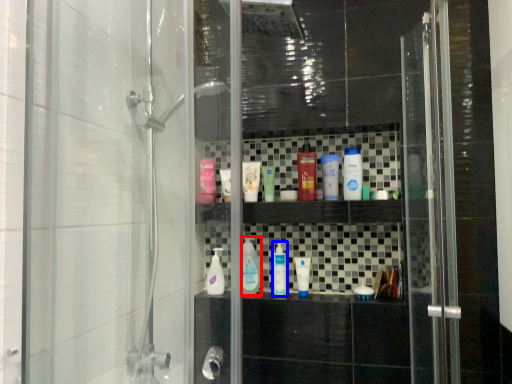
Question: Which point is closer to the camera, mouthwash (highlighted by a red box) or mouthwash (highlighted by a blue box)?

Choices:
 (A) mouthwash
 (B) mouthwash

Answer: (B)